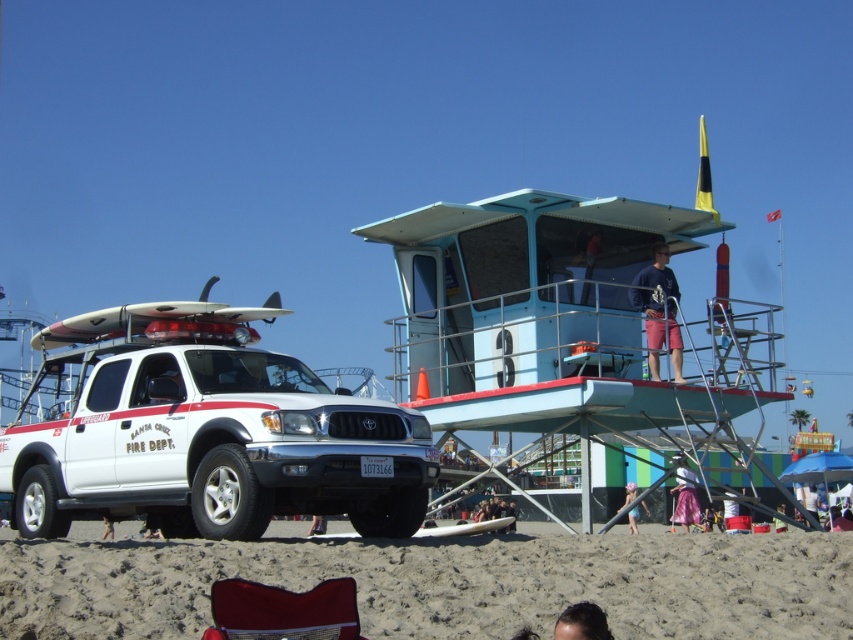
Question: Which object appears farthest from the camera in this image?

Choices:
 (A) pink fabric at lower right
 (B) skinny jeans at lower center
 (C) velvet red beach chair at lower center
 (D) brown sandy beach at lower center

Answer: (A)

Question: Estimate the real-world distances between objects in this image. Which object is farther from the velvet red beach chair at lower center?

Choices:
 (A) pink satin skirt at lower right
 (B) dark brown hair at lower center

Answer: (A)

Question: Can you confirm if dark blue shirt at center is positioned below pink satin skirt at lower right?

Choices:
 (A) no
 (B) yes

Answer: (A)

Question: Does brown sandy beach at lower center have a smaller size compared to dark blue shirt at center?

Choices:
 (A) no
 (B) yes

Answer: (A)

Question: Can you confirm if dark brown hair at lower center is positioned to the left of pink satin skirt at lower right?

Choices:
 (A) yes
 (B) no

Answer: (A)

Question: Which object is positioned farthest from the skinny jeans at lower center?

Choices:
 (A) dark brown hair at lower center
 (B) dark blue shirt at center
 (C) brown sandy beach at lower center
 (D) pink satin skirt at lower right

Answer: (B)